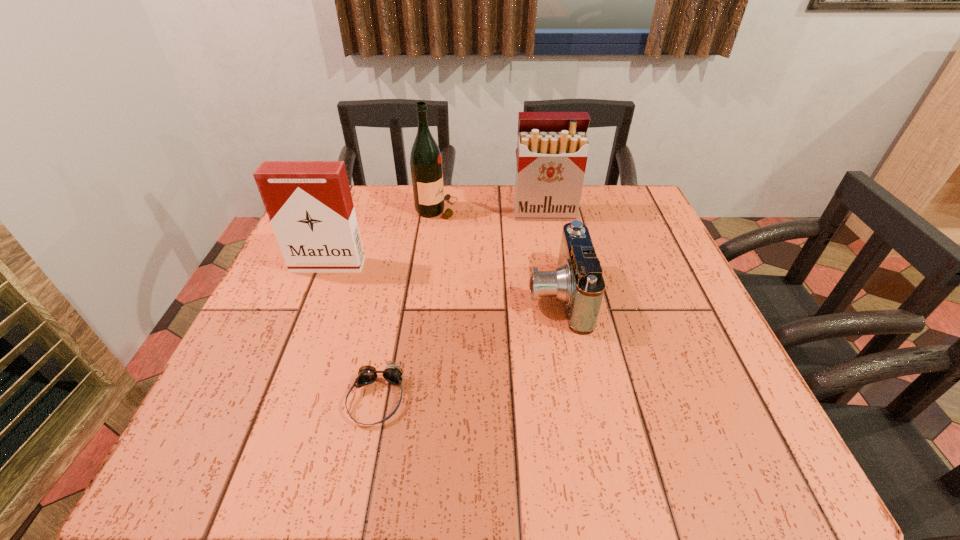
This screenshot has width=960, height=540. I want to click on wine bottle, so click(425, 161).

The width and height of the screenshot is (960, 540). What are the coordinates of `the right cigarette_case` in the screenshot? It's located at (552, 148).

At what (x,y) coordinates should I click in order to perform the action: click on the left cigarette_case. Please return your answer as a coordinate pair (x, y). Looking at the image, I should click on pos(309,203).

Image resolution: width=960 pixels, height=540 pixels. In order to click on the nearer cigarette_case in this screenshot , I will do `click(309, 203)`.

This screenshot has width=960, height=540. What are the coordinates of `camcorder` in the screenshot? It's located at (577, 282).

At what (x,y) coordinates should I click in order to perform the action: click on the shortest object. Please return your answer as a coordinate pair (x, y). The image size is (960, 540). Looking at the image, I should click on (367, 374).

This screenshot has width=960, height=540. I want to click on goggles, so click(367, 374).

Where is `vacant space situated on the surface of the wine bottle`? This screenshot has height=540, width=960. vacant space situated on the surface of the wine bottle is located at coordinates (564, 210).

Identify the location of free space located with the lid open on the right cigarette_case. The image size is (960, 540). (553, 257).

Identify the location of vacant space located 0.400m on the front-facing side of the leftmost object. (260, 437).